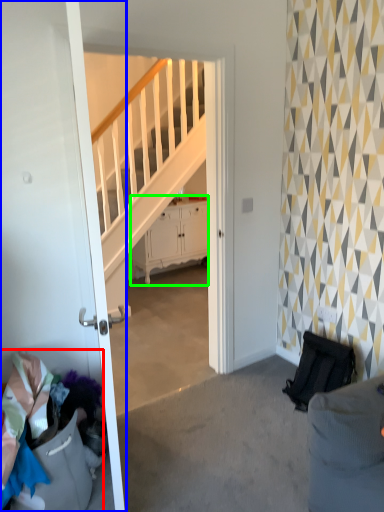
Question: Estimate the real-world distances between objects in this image. Which object is closer to laundry (highlighted by a red box), door (highlighted by a blue box) or cabinetry (highlighted by a green box)?

Choices:
 (A) door
 (B) cabinetry

Answer: (A)